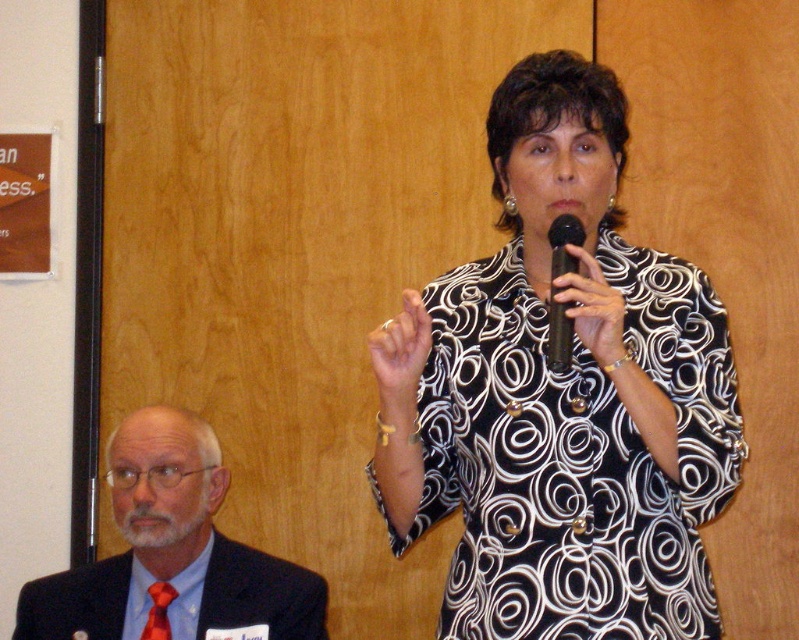
Is black printed dress at center closer to the viewer compared to black matte microphone at center?

That is False.

Which is behind, point (700, 449) or point (571, 237)?

The point (571, 237) is more distant.

Where is `black printed dress at center`? The width and height of the screenshot is (799, 640). black printed dress at center is located at coordinates (561, 396).

Is point (165, 529) positioned behind point (549, 308)?

Yes, point (165, 529) is behind point (549, 308).

Who is lower down, matte black suit at lower left or black matte microphone at center?

Positioned lower is matte black suit at lower left.

Does point (146, 589) come behind point (571, 264)?

Yes, it is.

Find the location of a particular element. The height and width of the screenshot is (640, 799). matte black suit at lower left is located at coordinates (173, 552).

Is black printed dress at center below matte black suit at lower left?

Incorrect, black printed dress at center is not positioned below matte black suit at lower left.

Who is more forward, (694,268) or (30,612)?

Point (694,268) is more forward.

You are a GUI agent. You are given a task and a screenshot of the screen. Output one action in this format:
    pyautogui.click(x=<x>, y=<y>)
    Task: Click on the black printed dress at center
    The height and width of the screenshot is (640, 799).
    Given the screenshot: What is the action you would take?
    pyautogui.click(x=561, y=396)